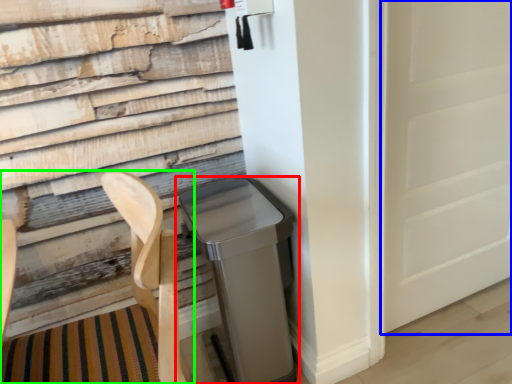
Question: Estimate the real-world distances between objects in this image. Which object is closer to waste container (highlighted by a red box), screen door (highlighted by a blue box) or folding chair (highlighted by a green box)?

Choices:
 (A) screen door
 (B) folding chair

Answer: (B)